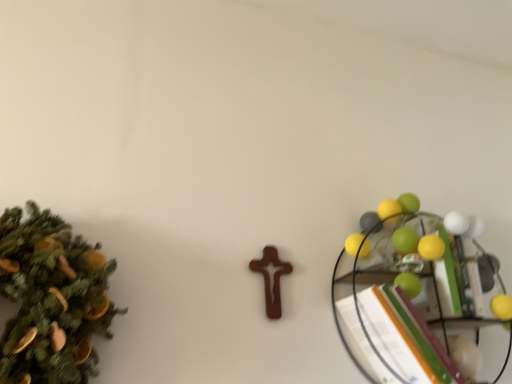
Question: Visually, is metallic wire shelf at right positioned to the left or to the right of green matte christmas tree at left?

Choices:
 (A) right
 (B) left

Answer: (A)

Question: Is point (456, 317) closer or farther from the camera than point (4, 379)?

Choices:
 (A) farther
 (B) closer

Answer: (A)

Question: Is metallic wire shelf at right situated inside green matte christmas tree at left or outside?

Choices:
 (A) inside
 (B) outside

Answer: (B)

Question: Considering the positions of green matte christmas tree at left and metallic wire shelf at right in the image, is green matte christmas tree at left wider or thinner than metallic wire shelf at right?

Choices:
 (A) wide
 (B) thin

Answer: (A)

Question: Is point (86, 352) positioned closer to the camera than point (433, 296)?

Choices:
 (A) closer
 (B) farther

Answer: (A)

Question: From their relative heights in the image, would you say green matte christmas tree at left is taller or shorter than metallic wire shelf at right?

Choices:
 (A) tall
 (B) short

Answer: (B)

Question: Looking at the image, does green matte christmas tree at left seem bigger or smaller compared to metallic wire shelf at right?

Choices:
 (A) small
 (B) big

Answer: (A)